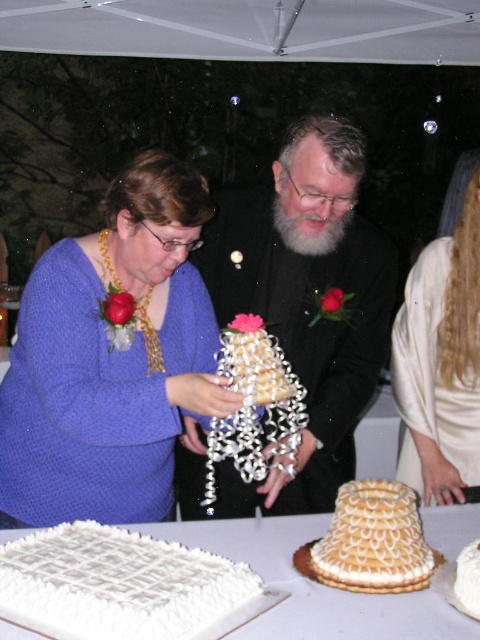
You are a photographer at the event and want to capture a clear shot of the golden textured cake at center without the matte gold necklace at center blocking it. How should you adjust your camera position?

The golden textured cake at center is behind the matte gold necklace at center, so you should move your camera position slightly forward to move the matte gold necklace at center out of the frame or angle the camera downward to focus on the golden textured cake at center directly.

You are a guest at the event and want to know which cake is larger between the golden textured cake at center and the white textured cake at center. Can you tell me which one is bigger?

The golden textured cake at center is bigger than the white textured cake at center.

You are at the point labeled point (456, 572) and want to walk towards the point labeled point (305, 554). Will you be moving forward or backward relative to your current position?

Since point (305, 554) is behind point (456, 572), moving towards it would mean you are moving backward relative to your current position.